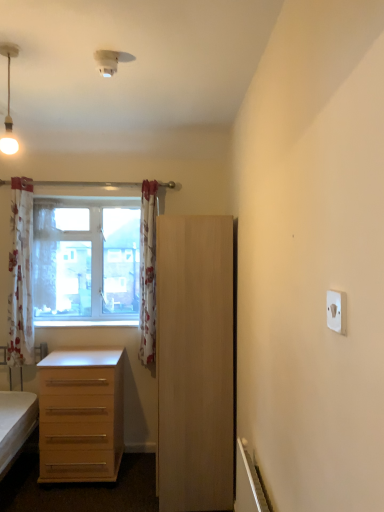
The image size is (384, 512). I want to click on vacant area on top of white floral curtain at window, which is the second curtain from left to right (from a real-world perspective), so click(44, 200).